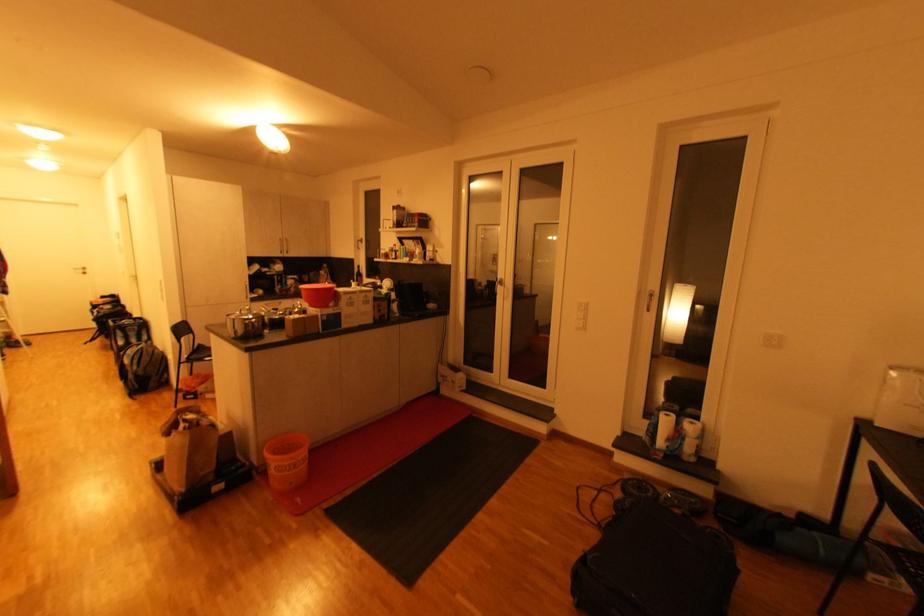
The height and width of the screenshot is (616, 924). Describe the element at coordinates (286, 446) in the screenshot. I see `a red bucket handle` at that location.